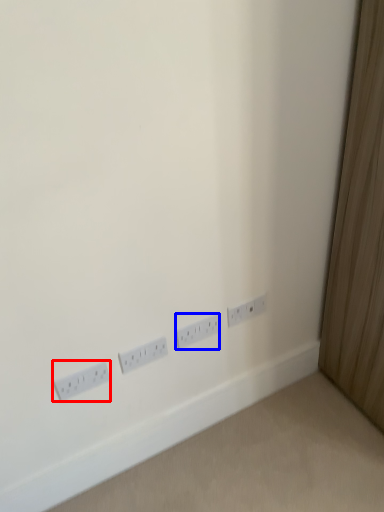
Question: Which point is further to the camera, power plugs and sockets (highlighted by a red box) or power plugs and sockets (highlighted by a blue box)?

Choices:
 (A) power plugs and sockets
 (B) power plugs and sockets

Answer: (B)